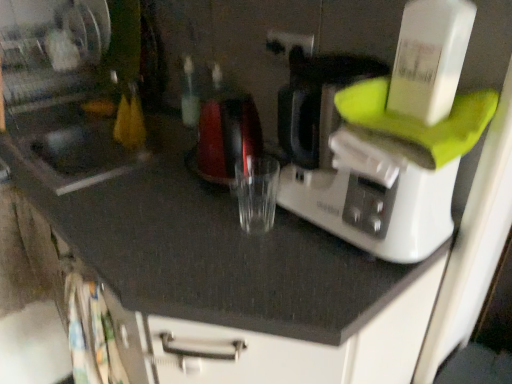
What are the coordinates of `white plastic coffee maker at center` in the screenshot? It's located at (399, 144).

The height and width of the screenshot is (384, 512). What do you see at coordinates (399, 144) in the screenshot?
I see `white plastic coffee maker at center` at bounding box center [399, 144].

What are the coordinates of `white plastic coffee maker at center` in the screenshot? It's located at (399, 144).